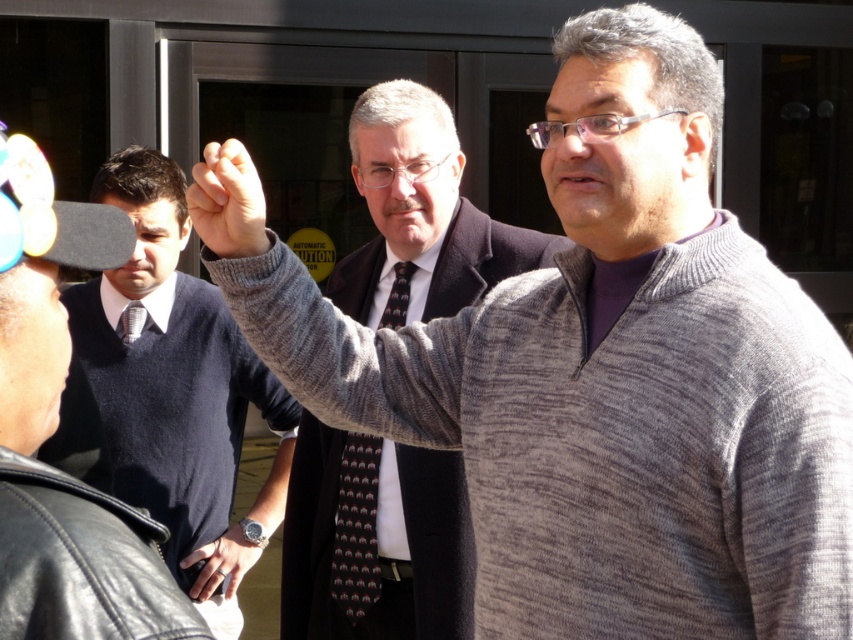
In the scene shown: Who is taller, dark gray textured tie at center or black leather watch at center?

With more height is dark gray textured tie at center.

Does point (405, 268) come closer to viewer compared to point (196, 593)?

Yes, it is in front of point (196, 593).

Find the location of `dark gray textured tie at center`. dark gray textured tie at center is located at coordinates (357, 529).

Is dark blue sweater at center further to the viewer compared to gray woolen sweater at center?

Yes, it is.

Can you confirm if dark blue sweater at center is smaller than gray woolen sweater at center?

No.

Does point (204, 387) come behind point (262, 228)?

Yes, point (204, 387) is behind point (262, 228).

What are the coordinates of `dark blue sweater at center` in the screenshot? It's located at (173, 372).

Can you confirm if dark gray textured tie at center is positioned to the left of gray woolen sweater at center?

Incorrect, dark gray textured tie at center is not on the left side of gray woolen sweater at center.

Which is above, dark gray textured tie at center or gray woolen sweater at center?

gray woolen sweater at center

Locate an element on the screen. This screenshot has height=640, width=853. dark gray textured tie at center is located at coordinates (357, 529).